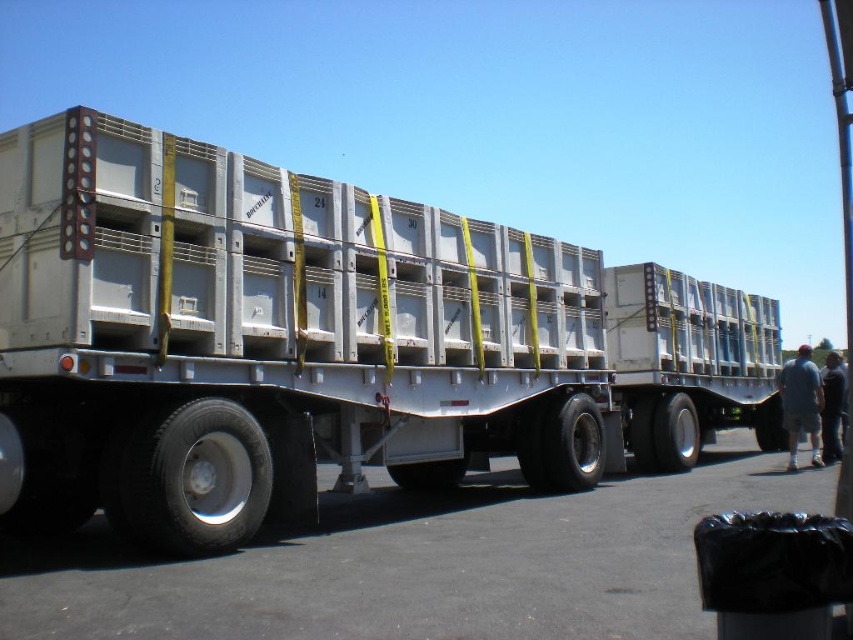
Does metallic gray trailer truck at center have a lesser width compared to gray cotton shorts at lower right?

Correct, metallic gray trailer truck at center's width is less than gray cotton shorts at lower right's.

Is point (500, 292) closer to viewer compared to point (793, 397)?

Yes, point (500, 292) is closer to viewer.

Who is more distant from viewer, (607, 304) or (802, 385)?

Positioned behind is point (607, 304).

Find the location of a particular element. The height and width of the screenshot is (640, 853). metallic gray trailer truck at center is located at coordinates (322, 342).